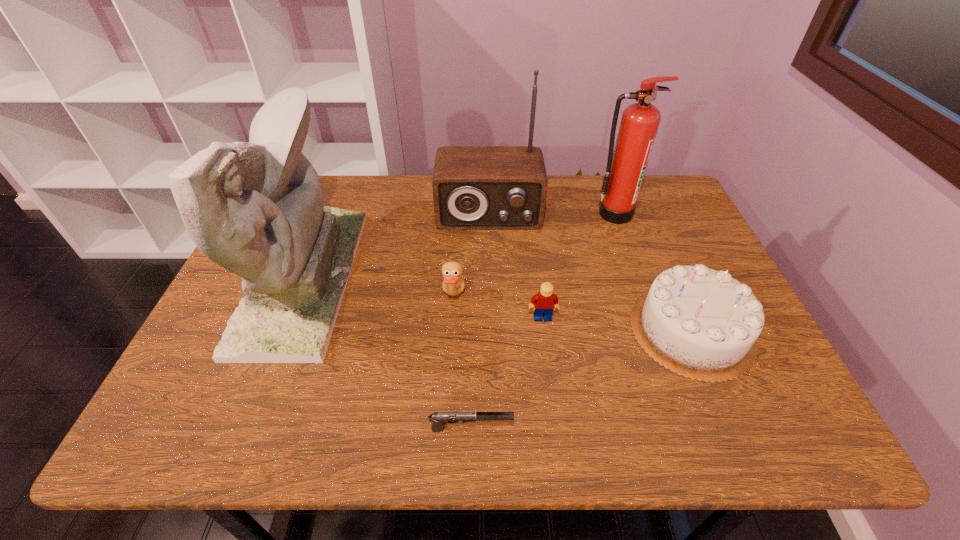
Locate which object is the fourth closest to the duck. Please provide its 2D coordinates. Your answer should be formatted as a tuple, i.e. [(x, y)], where the tuple contains the x and y coordinates of a point satisfying the conditions above.

[(439, 419)]

Where is `free location that satisfies the following two spatial constraints: 1. on the front-facing side of the birthday cake; 2. on the left side of the radio receiver`? The width and height of the screenshot is (960, 540). free location that satisfies the following two spatial constraints: 1. on the front-facing side of the birthday cake; 2. on the left side of the radio receiver is located at coordinates (492, 330).

Image resolution: width=960 pixels, height=540 pixels. Identify the location of free space that satisfies the following two spatial constraints: 1. with the nozzle pointing from the back of the fire extinguisher; 2. on the right side of the birthday cake. (656, 330).

At what (x,y) coordinates should I click in order to perform the action: click on vacant region that satisfies the following two spatial constraints: 1. on the front-facing side of the radio receiver; 2. on the base of the leftmost object. Please return your answer as a coordinate pair (x, y). Image resolution: width=960 pixels, height=540 pixels. Looking at the image, I should click on (491, 279).

I want to click on free space that satisfies the following two spatial constraints: 1. on the beak of the duck; 2. on the back side of the fourth shortest object, so click(451, 330).

I want to click on free location that satisfies the following two spatial constraints: 1. with the nozzle pointing from the back of the fourth tallest object; 2. on the left side of the fire extinguisher, so click(656, 330).

Where is `free space that satisfies the following two spatial constraints: 1. on the beak of the duck; 2. on the right side of the birthday cake`? This screenshot has height=540, width=960. free space that satisfies the following two spatial constraints: 1. on the beak of the duck; 2. on the right side of the birthday cake is located at coordinates (451, 330).

Where is `vacant space that satisfies the following two spatial constraints: 1. on the front-facing side of the Lego; 2. on the right side of the birthday cake`? The height and width of the screenshot is (540, 960). vacant space that satisfies the following two spatial constraints: 1. on the front-facing side of the Lego; 2. on the right side of the birthday cake is located at coordinates (544, 330).